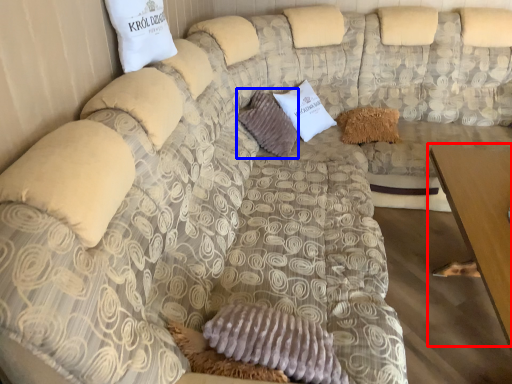
Question: Which of the following is the closest to the observer, table (highlighted by a red box) or pillow (highlighted by a blue box)?

Choices:
 (A) table
 (B) pillow

Answer: (A)